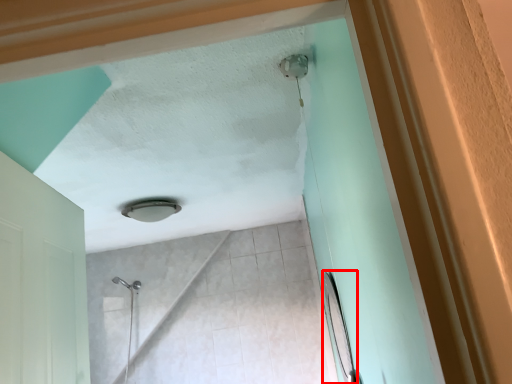
Question: Considering the relative positions of mirror (annotated by the red box) and lamp in the image provided, where is mirror (annotated by the red box) located with respect to the staircase?

Choices:
 (A) left
 (B) right

Answer: (B)